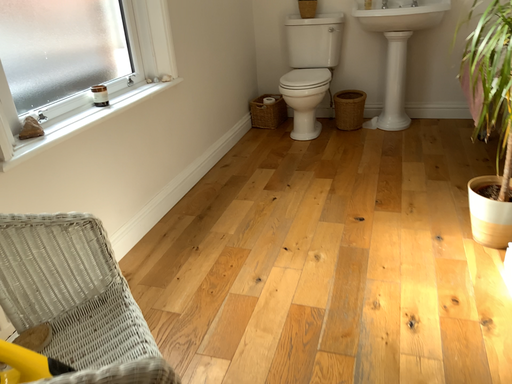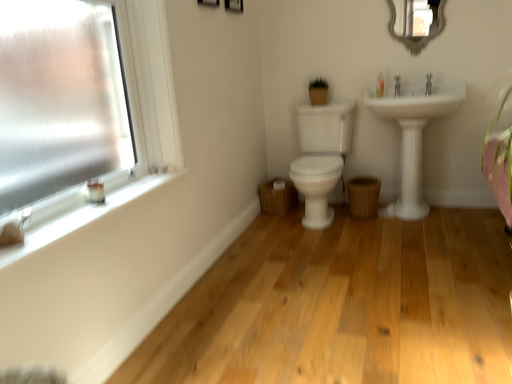
Question: Which way did the camera rotate in the video?

Choices:
 (A) rotated downward
 (B) rotated upward

Answer: (B)